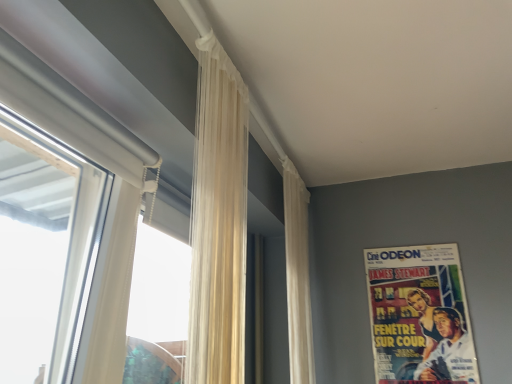
Question: From a real-world perspective, is vintage paper poster at upper right on white matte window at left?

Choices:
 (A) yes
 (B) no

Answer: (B)

Question: Is vintage paper poster at upper right taller than white matte window at left?

Choices:
 (A) no
 (B) yes

Answer: (A)

Question: From a real-world perspective, is vintage paper poster at upper right under white matte window at left?

Choices:
 (A) yes
 (B) no

Answer: (A)

Question: Does vintage paper poster at upper right have a lesser width compared to white matte window at left?

Choices:
 (A) yes
 (B) no

Answer: (A)

Question: From the image's perspective, is vintage paper poster at upper right under white matte window at left?

Choices:
 (A) no
 (B) yes

Answer: (B)

Question: Relative to vintage paper poster at upper right, is translucent cream curtain at center, the 2th curtain positioned from the right, in front or behind?

Choices:
 (A) front
 (B) behind

Answer: (A)

Question: Looking at their shapes, would you say translucent cream curtain at center, the second curtain viewed from the back, is wider or thinner than vintage paper poster at upper right?

Choices:
 (A) thin
 (B) wide

Answer: (B)

Question: Based on their sizes in the image, would you say translucent cream curtain at center, placed as the 1th curtain when sorted from front to back, is bigger or smaller than vintage paper poster at upper right?

Choices:
 (A) big
 (B) small

Answer: (A)

Question: From the image's perspective, is translucent cream curtain at center, placed as the 1th curtain when sorted from front to back, positioned above or below vintage paper poster at upper right?

Choices:
 (A) below
 (B) above

Answer: (B)

Question: Considering the positions of vintage paper poster at upper right and translucent cream curtain at center, placed as the 1th curtain when sorted from front to back, in the image, is vintage paper poster at upper right wider or thinner than translucent cream curtain at center, placed as the 1th curtain when sorted from front to back,?

Choices:
 (A) wide
 (B) thin

Answer: (B)

Question: Does point [x=407, y=372] appear closer or farther from the camera than point [x=243, y=283]?

Choices:
 (A) farther
 (B) closer

Answer: (A)

Question: Is vintage paper poster at upper right inside the boundaries of translucent cream curtain at center, the second curtain viewed from the back, or outside?

Choices:
 (A) outside
 (B) inside

Answer: (A)

Question: Considering the positions of vintage paper poster at upper right and translucent cream curtain at center, the second curtain viewed from the back, in the image, is vintage paper poster at upper right taller or shorter than translucent cream curtain at center, the second curtain viewed from the back,?

Choices:
 (A) short
 (B) tall

Answer: (A)

Question: Is point pos(294,273) positioned closer to the camera than point pos(391,278)?

Choices:
 (A) farther
 (B) closer

Answer: (B)

Question: From a real-world perspective, is white sheer curtain at upper center, which ranks as the second curtain in front-to-back order, above or below vintage paper poster at upper right?

Choices:
 (A) below
 (B) above

Answer: (B)